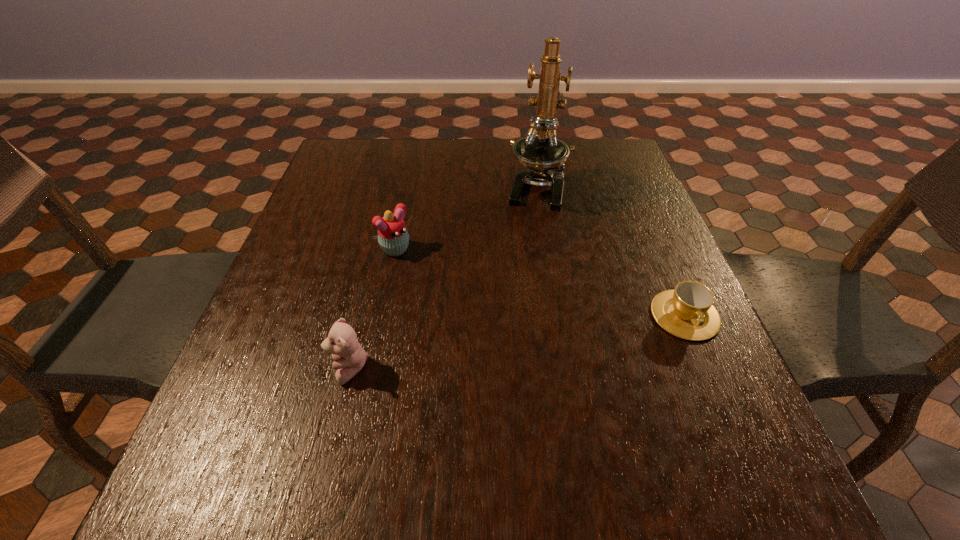
Find the location of a particular element. The height and width of the screenshot is (540, 960). vacant space located 0.130m at the eyepiece of the third object from left to right is located at coordinates (528, 247).

Find the location of `free spot located 0.240m at the eyepiece of the third object from left to right`. free spot located 0.240m at the eyepiece of the third object from left to right is located at coordinates (521, 280).

Find the location of a particular element. Image resolution: width=960 pixels, height=540 pixels. free region located 0.370m at the eyepiece of the third object from left to right is located at coordinates (513, 326).

Find the location of `free space located on the face of the second farthest object`. free space located on the face of the second farthest object is located at coordinates (428, 276).

Locate an element on the screen. This screenshot has height=540, width=960. vacant space situated on the face of the second farthest object is located at coordinates (480, 321).

The height and width of the screenshot is (540, 960). In order to click on vacant space positioned 0.240m on the face of the second farthest object in this screenshot , I will do `click(480, 321)`.

Where is `object located at the far edge`? This screenshot has width=960, height=540. object located at the far edge is located at coordinates (540, 151).

Locate an element on the screen. The image size is (960, 540). object that is at the right edge is located at coordinates (687, 311).

This screenshot has width=960, height=540. I want to click on free region at the far edge of the desktop, so click(x=445, y=166).

This screenshot has width=960, height=540. I want to click on free space at the near edge, so click(464, 396).